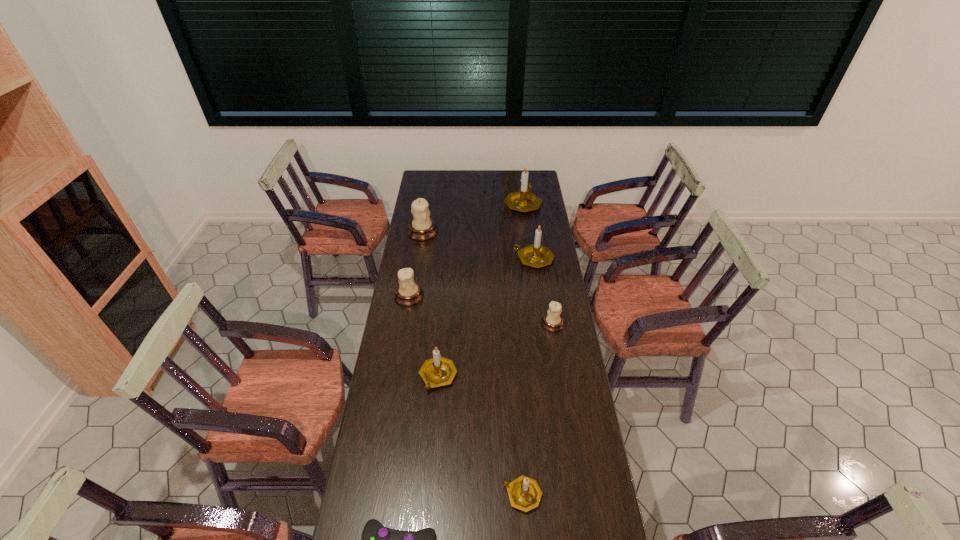
This screenshot has height=540, width=960. Find the location of `free location that satisfies the following two spatial constraints: 1. on the front side of the nearest candle holder; 2. on the right side of the second farthest candle holder`. free location that satisfies the following two spatial constraints: 1. on the front side of the nearest candle holder; 2. on the right side of the second farthest candle holder is located at coordinates (381, 495).

Where is `blank area in the image that satisfies the following two spatial constraints: 1. on the front side of the second nearest white candle holder; 2. on the right side of the nearest gold candle holder`? The image size is (960, 540). blank area in the image that satisfies the following two spatial constraints: 1. on the front side of the second nearest white candle holder; 2. on the right side of the nearest gold candle holder is located at coordinates (376, 495).